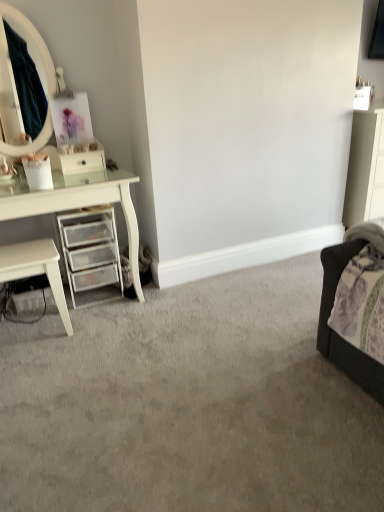
Question: Can you confirm if white glossy drawer at left is wider than clear plastic drawers at left?

Choices:
 (A) no
 (B) yes

Answer: (A)

Question: Is white glossy drawer at left further to the viewer compared to clear plastic drawers at left?

Choices:
 (A) no
 (B) yes

Answer: (B)

Question: From the image's perspective, would you say white glossy drawer at left is shown under clear plastic drawers at left?

Choices:
 (A) no
 (B) yes

Answer: (A)

Question: Considering the relative positions of white glossy drawer at left and clear plastic drawers at left in the image provided, is white glossy drawer at left to the right of clear plastic drawers at left from the viewer's perspective?

Choices:
 (A) no
 (B) yes

Answer: (B)

Question: Is white glossy drawer at left bigger than clear plastic drawers at left?

Choices:
 (A) yes
 (B) no

Answer: (B)

Question: Considering the relative sizes of white glossy drawer at left and clear plastic drawers at left in the image provided, is white glossy drawer at left taller than clear plastic drawers at left?

Choices:
 (A) yes
 (B) no

Answer: (B)

Question: Does white glossy nightstand at left have a greater height compared to clear plastic drawers at left?

Choices:
 (A) yes
 (B) no

Answer: (B)

Question: Can you confirm if white glossy nightstand at left is positioned to the left of clear plastic drawers at left?

Choices:
 (A) no
 (B) yes

Answer: (B)

Question: Considering the relative sizes of white glossy nightstand at left and clear plastic drawers at left in the image provided, is white glossy nightstand at left shorter than clear plastic drawers at left?

Choices:
 (A) no
 (B) yes

Answer: (B)

Question: From a real-world perspective, does white glossy nightstand at left stand above clear plastic drawers at left?

Choices:
 (A) no
 (B) yes

Answer: (A)

Question: From a real-world perspective, is white glossy nightstand at left located beneath clear plastic drawers at left?

Choices:
 (A) no
 (B) yes

Answer: (B)

Question: From the image's perspective, is white glossy nightstand at left located beneath clear plastic drawers at left?

Choices:
 (A) yes
 (B) no

Answer: (A)

Question: Does white glossy drawer at left come behind white glossy nightstand at left?

Choices:
 (A) yes
 (B) no

Answer: (A)